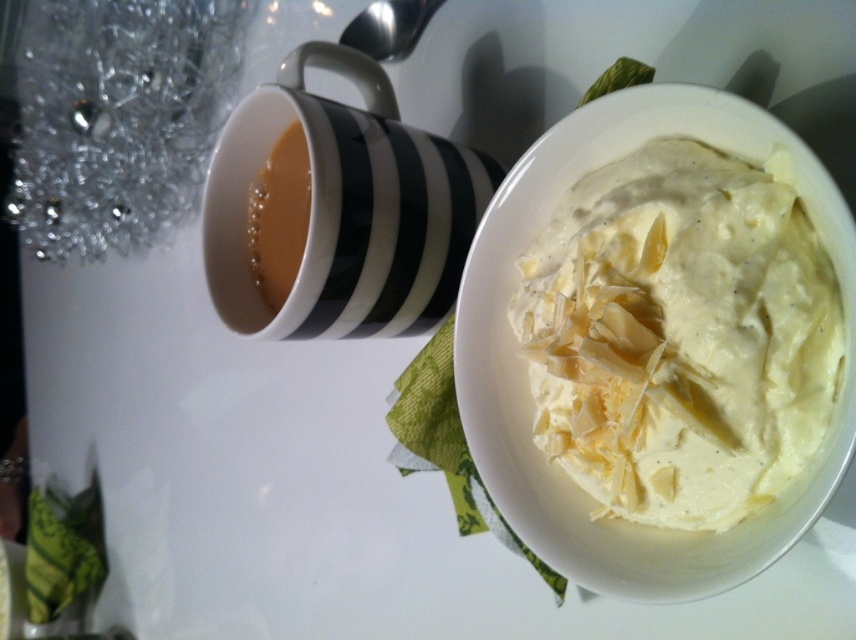
Question: Is black striped mug at upper left positioned in front of brown glossy coffee at upper left?

Choices:
 (A) no
 (B) yes

Answer: (B)

Question: Which object appears closest to the camera in this image?

Choices:
 (A) white creamy pasta at center
 (B) brown glossy coffee at upper left
 (C) black striped mug at upper left

Answer: (A)

Question: Which of the following is the farthest from the observer?

Choices:
 (A) (340, 118)
 (B) (278, 150)
 (C) (563, 285)

Answer: (B)

Question: Is white creamy pasta at center to the left of black striped mug at upper left from the viewer's perspective?

Choices:
 (A) no
 (B) yes

Answer: (A)

Question: Is white creamy pasta at center bigger than brown glossy coffee at upper left?

Choices:
 (A) yes
 (B) no

Answer: (A)

Question: Considering the real-world distances, which object is closest to the white creamy pasta at center?

Choices:
 (A) brown glossy coffee at upper left
 (B) black striped mug at upper left

Answer: (B)